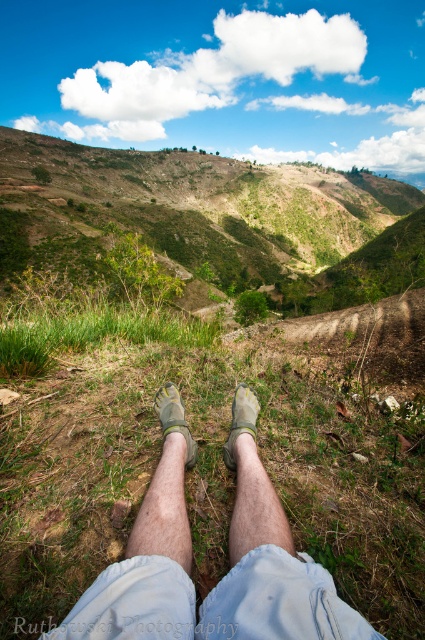
Question: Based on their relative distances, which object is nearer to the gray fabric leg at center?

Choices:
 (A) light gray fabric sock at center
 (B) light gray fabric leg at center

Answer: (B)

Question: Based on their relative distances, which object is nearer to the green grass at lower center?

Choices:
 (A) light gray fabric sock at center
 (B) gray fabric leg at center
 (C) matte gray sandal at center

Answer: (C)

Question: Does gray fabric leg at center appear over light gray fabric sock at center?

Choices:
 (A) no
 (B) yes

Answer: (A)

Question: Can you confirm if gray fabric leg at center is smaller than light gray fabric sock at center?

Choices:
 (A) no
 (B) yes

Answer: (A)

Question: Among these objects, which one is farthest from the camera?

Choices:
 (A) light gray fabric sock at center
 (B) light gray fabric legs at center
 (C) green grassy hillside at upper center

Answer: (C)

Question: Is green grass at lower center to the right of gray fabric leg at center from the viewer's perspective?

Choices:
 (A) no
 (B) yes

Answer: (A)